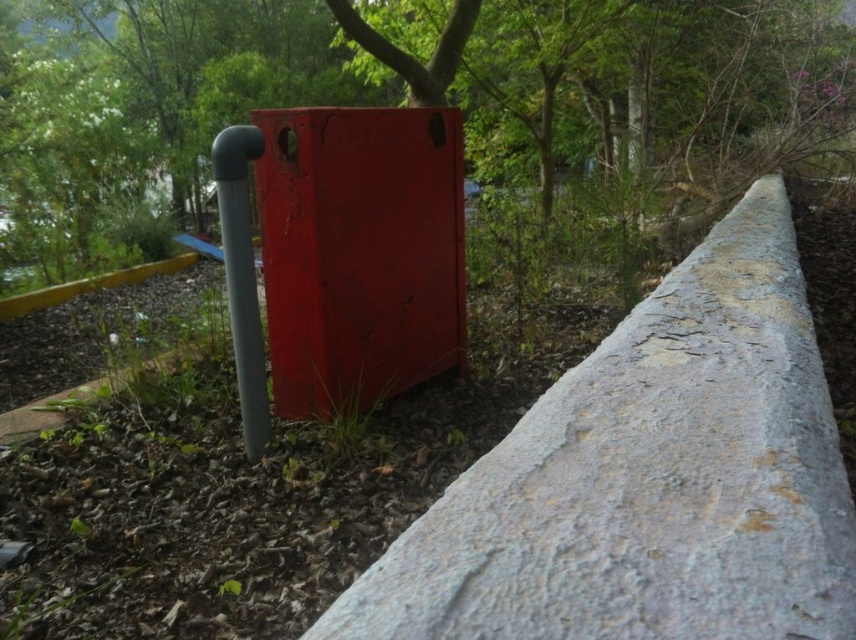
You are a gardener planning to plant a new flower bed near the green leafy tree at upper center and the matte red box at center. Considering their positions, which object is directly above the other?

The green leafy tree at upper center is positioned over the matte red box at center, so the tree is directly above the box.